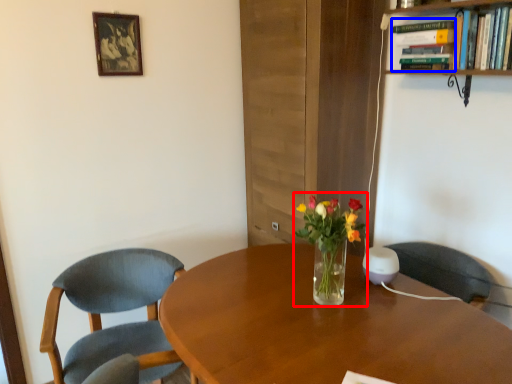
Question: Which point is closer to the camera, floral arrangement (highlighted by a red box) or book (highlighted by a blue box)?

Choices:
 (A) floral arrangement
 (B) book

Answer: (A)